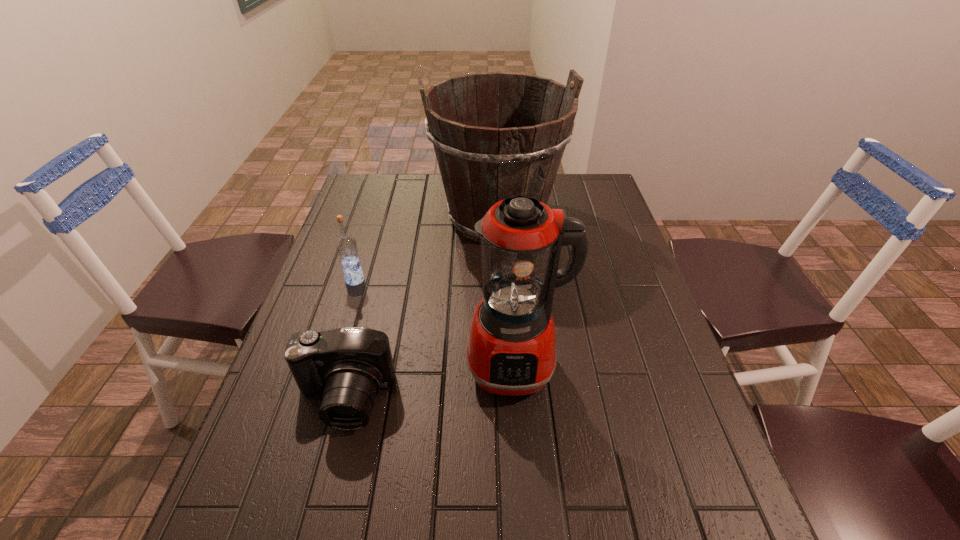
Where is `vodka present at the left edge`? The height and width of the screenshot is (540, 960). vodka present at the left edge is located at coordinates (346, 245).

Where is `camera that is positioned at the left edge`? Image resolution: width=960 pixels, height=540 pixels. camera that is positioned at the left edge is located at coordinates (351, 364).

In the image, there is a desktop. Where is `free space at the far edge`? free space at the far edge is located at coordinates (402, 197).

Find the location of a particular element. The height and width of the screenshot is (540, 960). blank area at the left edge is located at coordinates (372, 280).

Identify the location of free space at the right edge. (606, 310).

Find the location of a particular element. This screenshot has width=960, height=540. vacant space at the far left corner of the desktop is located at coordinates click(x=377, y=176).

Where is `free space at the far right corner`? free space at the far right corner is located at coordinates (572, 205).

Where is `vacant space that is in between the bucket and the third tallest object`? The width and height of the screenshot is (960, 540). vacant space that is in between the bucket and the third tallest object is located at coordinates (425, 248).

Image resolution: width=960 pixels, height=540 pixels. In order to click on free space between the camera and the food processor in this screenshot , I will do pyautogui.click(x=429, y=383).

This screenshot has width=960, height=540. Identify the location of empty space that is in between the third nearest object and the farthest object. (425, 248).